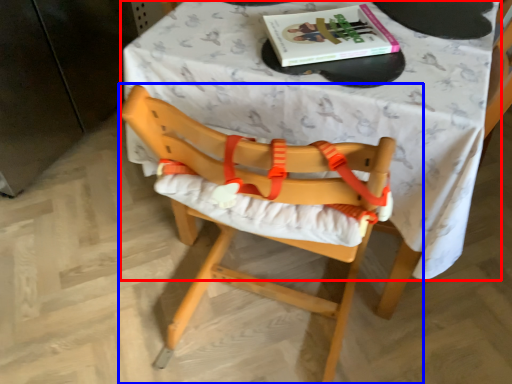
Question: Which object is further to the camera taking this photo, table (highlighted by a red box) or chair (highlighted by a blue box)?

Choices:
 (A) table
 (B) chair

Answer: (A)